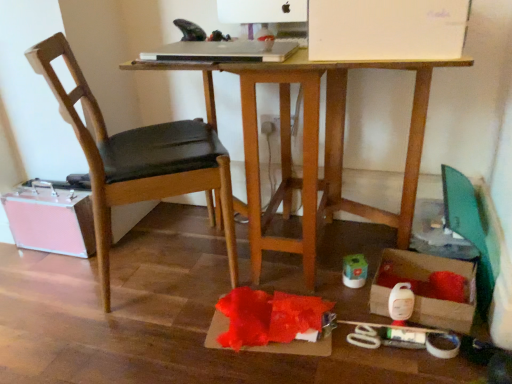
Describe the element at coordinates (224, 51) in the screenshot. The image size is (512, 384). I see `silver metallic laptop at upper center` at that location.

In order to face cardboard box at lower right, which ranks as the 2th storage box in back-to-front order, should I rotate leftwards or rightwards?

You should rotate right by 21.425 degrees.

This screenshot has height=384, width=512. What do you see at coordinates (138, 158) in the screenshot? I see `black leather chair at left` at bounding box center [138, 158].

Find the location of a particular element. This screenshot has height=384, width=512. black leather chair at left is located at coordinates (138, 158).

Locate an element on the screen. The width and height of the screenshot is (512, 384). wooden desk at center is located at coordinates (312, 145).

Describe the element at coordinates (51, 220) in the screenshot. Image resolution: width=512 pixels, height=384 pixels. I see `pink metallic suitcase at lower left, positioned as the 2th storage box in front-to-back order` at that location.

Looking at this image, measure the distance between pink metallic suitcase at lower left, placed as the 2th storage box when sorted from right to left, and camera.

A distance of 1.58 meters exists between pink metallic suitcase at lower left, placed as the 2th storage box when sorted from right to left, and camera.

What do you see at coordinates (269, 124) in the screenshot?
I see `matte white power plugs and sockets at center` at bounding box center [269, 124].

Find the location of `matte white power plugs and sockets at center`. matte white power plugs and sockets at center is located at coordinates (269, 124).

You are a GUI agent. You are given a task and a screenshot of the screen. Output one action in this format:
    pyautogui.click(x=<x>, y=<y>)
    Task: Click on the silver metallic laptop at upper center
    
    Given the screenshot: What is the action you would take?
    pyautogui.click(x=224, y=51)

Could matte white power plugs and sockets at center be considered to be inside silver metallic laptop at upper center?

No, matte white power plugs and sockets at center is not a part of silver metallic laptop at upper center.

Considering the sizes of objects silver metallic laptop at upper center and matte white power plugs and sockets at center in the image provided, who is wider, silver metallic laptop at upper center or matte white power plugs and sockets at center?

silver metallic laptop at upper center is wider.

From the image's perspective, which object appears higher, silver metallic laptop at upper center or matte white power plugs and sockets at center?

silver metallic laptop at upper center appears higher in the image.

From a real-world perspective, who is located lower, silver metallic laptop at upper center or matte white power plugs and sockets at center?

From a 3D spatial view, matte white power plugs and sockets at center is below.

Can you tell me how much cardboard box at lower right, the 1th storage box in the front-to-back sequence, and black leather chair at left differ in facing direction?

123 degrees separate the facing orientations of cardboard box at lower right, the 1th storage box in the front-to-back sequence, and black leather chair at left.

Considering their positions, is cardboard box at lower right, which is counted as the second storage box, starting from the left, located in front of or behind black leather chair at left?

Clearly, cardboard box at lower right, which is counted as the second storage box, starting from the left, is behind black leather chair at left.

Can black leather chair at left be found inside cardboard box at lower right, the 1th storage box in the front-to-back sequence?

No, black leather chair at left is not surrounded by cardboard box at lower right, the 1th storage box in the front-to-back sequence.

From the image's perspective, is cardboard box at lower right, which ranks as the 2th storage box in back-to-front order, located beneath black leather chair at left?

Indeed, from the image's perspective, cardboard box at lower right, which ranks as the 2th storage box in back-to-front order, is shown beneath black leather chair at left.

Can we say pink metallic suitcase at lower left, positioned as the 2th storage box in front-to-back order, lies outside wooden desk at center?

Absolutely, pink metallic suitcase at lower left, positioned as the 2th storage box in front-to-back order, is external to wooden desk at center.

How many degrees apart are the facing directions of pink metallic suitcase at lower left, the first storage box from the back, and wooden desk at center?

1.26 degrees separate the facing orientations of pink metallic suitcase at lower left, the first storage box from the back, and wooden desk at center.

Could you tell me if pink metallic suitcase at lower left, placed as the 2th storage box when sorted from right to left, is facing wooden desk at center?

No, pink metallic suitcase at lower left, placed as the 2th storage box when sorted from right to left, does not turn towards wooden desk at center.

Who is more distant, pink metallic suitcase at lower left, positioned as the 2th storage box in front-to-back order, or wooden desk at center?

pink metallic suitcase at lower left, positioned as the 2th storage box in front-to-back order, is further away from the camera.

From a real-world perspective, is silver metallic laptop at upper center positioned over wooden desk at center based on gravity?

Indeed, from a real-world perspective, silver metallic laptop at upper center stands above wooden desk at center.

Which object is further away from the camera, silver metallic laptop at upper center or wooden desk at center?

silver metallic laptop at upper center is more distant.

How much distance is there between silver metallic laptop at upper center and wooden desk at center?

silver metallic laptop at upper center and wooden desk at center are 13.93 inches apart.

Is silver metallic laptop at upper center located outside wooden desk at center?

silver metallic laptop at upper center is positioned outside wooden desk at center.

From the image's perspective, is cardboard box at lower right, which is counted as the second storage box, starting from the left, located above or below silver metallic laptop at upper center?

Clearly, from the image's perspective, cardboard box at lower right, which is counted as the second storage box, starting from the left, is below silver metallic laptop at upper center.

What's the angular difference between cardboard box at lower right, the 1th storage box in the front-to-back sequence, and silver metallic laptop at upper center's facing directions?

The angular difference between cardboard box at lower right, the 1th storage box in the front-to-back sequence, and silver metallic laptop at upper center is 1.26 degrees.

From a real-world perspective, which object stands above the other?

silver metallic laptop at upper center is physically above.

Looking at the image, does cardboard box at lower right, which ranks as the 2th storage box in back-to-front order, seem bigger or smaller compared to silver metallic laptop at upper center?

cardboard box at lower right, which ranks as the 2th storage box in back-to-front order, is bigger than silver metallic laptop at upper center.

Based on their positions, is pink metallic suitcase at lower left, placed as the 2th storage box when sorted from right to left, located to the left or right of silver metallic laptop at upper center?

From the image, it's evident that pink metallic suitcase at lower left, placed as the 2th storage box when sorted from right to left, is to the left of silver metallic laptop at upper center.

Is pink metallic suitcase at lower left, which is the first storage box in left-to-right order, facing towards silver metallic laptop at upper center?

No, pink metallic suitcase at lower left, which is the first storage box in left-to-right order, is not turned towards silver metallic laptop at upper center.

From the image's perspective, which one is positioned higher, pink metallic suitcase at lower left, positioned as the 2th storage box in front-to-back order, or silver metallic laptop at upper center?

silver metallic laptop at upper center, from the image's perspective.

Can you confirm if pink metallic suitcase at lower left, positioned as the 2th storage box in front-to-back order, is taller than silver metallic laptop at upper center?

Yes, pink metallic suitcase at lower left, positioned as the 2th storage box in front-to-back order, is taller than silver metallic laptop at upper center.

Is black leather chair at left facing towards silver metallic laptop at upper center?

Yes, black leather chair at left faces towards silver metallic laptop at upper center.

Between black leather chair at left and silver metallic laptop at upper center, which one appears on the left side from the viewer's perspective?

black leather chair at left is more to the left.

How much distance is there between black leather chair at left and silver metallic laptop at upper center?

black leather chair at left and silver metallic laptop at upper center are 14.98 inches apart.

Between point (233, 280) and point (215, 48), which one is positioned in front?

Point (215, 48)

At what (x,y) coordinates should I click in order to perform the action: click on power plugs and sockets below the silver metallic laptop at upper center (from the image's perspective). Please return your answer as a coordinate pair (x, y). Image resolution: width=512 pixels, height=384 pixels. Looking at the image, I should click on (269, 124).

Locate an element on the screen. The image size is (512, 384). chair above the cardboard box at lower right, positioned as the 1th storage box in right-to-left order (from a real-world perspective) is located at coordinates (138, 158).

Based on their spatial positions, is matte white power plugs and sockets at center or cardboard box at lower right, the 1th storage box in the front-to-back sequence, further from pink metallic suitcase at lower left, the first storage box from the back?

Based on the image, cardboard box at lower right, the 1th storage box in the front-to-back sequence, appears to be further to pink metallic suitcase at lower left, the first storage box from the back.

Considering their positions, is pink metallic suitcase at lower left, positioned as the 2th storage box in front-to-back order, positioned closer to black leather chair at left than cardboard box at lower right, which is counted as the second storage box, starting from the left?

pink metallic suitcase at lower left, positioned as the 2th storage box in front-to-back order.

Which object lies nearer to the anchor point pink metallic suitcase at lower left, which is the first storage box in left-to-right order, wooden desk at center or silver metallic laptop at upper center?

wooden desk at center is positioned closer to the anchor pink metallic suitcase at lower left, which is the first storage box in left-to-right order.

Estimate the real-world distances between objects in this image. Which object is closer to silver metallic laptop at upper center, black leather chair at left or cardboard box at lower right, positioned as the 1th storage box in right-to-left order?

The object closer to silver metallic laptop at upper center is black leather chair at left.

Which object lies further to the anchor point cardboard box at lower right, positioned as the 1th storage box in right-to-left order, wooden desk at center or matte white power plugs and sockets at center?

matte white power plugs and sockets at center.

Which object lies nearer to the anchor point matte white power plugs and sockets at center, wooden desk at center or silver metallic laptop at upper center?

wooden desk at center is closer to matte white power plugs and sockets at center.

Based on their spatial positions, is pink metallic suitcase at lower left, the first storage box from the back, or cardboard box at lower right, which ranks as the 2th storage box in back-to-front order, further from matte white power plugs and sockets at center?

pink metallic suitcase at lower left, the first storage box from the back, is further to matte white power plugs and sockets at center.

From the picture: Estimate the real-world distances between objects in this image. Which object is further from silver metallic laptop at upper center, matte white power plugs and sockets at center or wooden desk at center?

Based on the image, matte white power plugs and sockets at center appears to be further to silver metallic laptop at upper center.

Image resolution: width=512 pixels, height=384 pixels. What are the coordinates of `chair between pink metallic suitcase at lower left, positioned as the 2th storage box in front-to-back order, and silver metallic laptop at upper center, in the horizontal direction` in the screenshot? It's located at (138, 158).

At what (x,y) coordinates should I click in order to perform the action: click on desk between silver metallic laptop at upper center and cardboard box at lower right, positioned as the 1th storage box in right-to-left order, from top to bottom. Please return your answer as a coordinate pair (x, y). Looking at the image, I should click on (312, 145).

The width and height of the screenshot is (512, 384). Find the location of `desk between pink metallic suitcase at lower left, placed as the 2th storage box when sorted from right to left, and cardboard box at lower right, which ranks as the 2th storage box in back-to-front order`. desk between pink metallic suitcase at lower left, placed as the 2th storage box when sorted from right to left, and cardboard box at lower right, which ranks as the 2th storage box in back-to-front order is located at coordinates (312, 145).

Where is `chair located between wooden desk at center and matte white power plugs and sockets at center in the depth direction`? This screenshot has width=512, height=384. chair located between wooden desk at center and matte white power plugs and sockets at center in the depth direction is located at coordinates (138, 158).